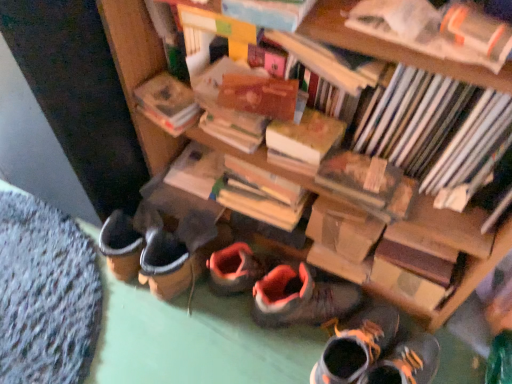
Locate an element on the screen. leather boot at lower center, arranged as the 1th footwear when viewed from the right is located at coordinates (356, 346).

What do you see at coordinates (356, 346) in the screenshot? I see `leather boot at lower center, the 2th footwear positioned from the left` at bounding box center [356, 346].

Find the location of a particular element. wooden bookcase at center is located at coordinates (138, 71).

Measure the distance between hardcover book at upper right, which appears as the fifth book when viewed from the back, and camera.

The distance of hardcover book at upper right, which appears as the fifth book when viewed from the back, from camera is 21.93 inches.

The width and height of the screenshot is (512, 384). Describe the element at coordinates (479, 27) in the screenshot. I see `hardcover book at upper right, which appears as the fifth book when viewed from the back` at that location.

Locate an element on the screen. This screenshot has width=512, height=384. hardcover books at upper right, which is the 3th book in front-to-back order is located at coordinates (433, 126).

Describe the element at coordinates (229, 188) in the screenshot. I see `hardcover book at center, which is the second book from back to front` at that location.

In order to click on hardcover book at upper center, positioned as the second book in front-to-back order in this screenshot , I will do `click(269, 12)`.

From the image's perspective, which is below, hardcover book at center, which is counted as the 1th book, starting from the back, or hardcover book at upper right, the 1th book viewed from the front?

hardcover book at center, which is counted as the 1th book, starting from the back.

Is hardcover book at center, arranged as the fifth book when viewed from the front, not close to hardcover book at upper right, the 1th book viewed from the front?

hardcover book at center, arranged as the fifth book when viewed from the front, is actually quite close to hardcover book at upper right, the 1th book viewed from the front.

From a real-world perspective, is hardcover book at center, arranged as the fifth book when viewed from the front, physically below hardcover book at upper right, which appears as the fifth book when viewed from the back?

Yes, from a real-world perspective, hardcover book at center, arranged as the fifth book when viewed from the front, is below hardcover book at upper right, which appears as the fifth book when viewed from the back.

You are a GUI agent. You are given a task and a screenshot of the screen. Output one action in this format:
    pyautogui.click(x=<x>, y=<y>)
    Task: Click on the 2nd book positioned above the hardcover book at center, which is counted as the 1th book, starting from the back (from the image's perspective)
    
    Given the screenshot: What is the action you would take?
    pyautogui.click(x=479, y=27)

Is there a large distance between hardcover books at upper right, which is the 3th book in front-to-back order, and hardcover book at upper right, which appears as the fifth book when viewed from the back?

No, there isn't a large distance between hardcover books at upper right, which is the 3th book in front-to-back order, and hardcover book at upper right, which appears as the fifth book when viewed from the back.

What's the angular difference between hardcover books at upper right, which is the 3th book in front-to-back order, and hardcover book at upper right, the 1th book viewed from the front,'s facing directions?

The angle between the facing direction of hardcover books at upper right, which is the 3th book in front-to-back order, and the facing direction of hardcover book at upper right, the 1th book viewed from the front, is 0.000267 degrees.

Consider the image. From the image's perspective, is hardcover books at upper right, marked as the third book in a back-to-front arrangement, located above or below hardcover book at upper right, which appears as the fifth book when viewed from the back?

From the image's perspective, hardcover books at upper right, marked as the third book in a back-to-front arrangement, appears below hardcover book at upper right, which appears as the fifth book when viewed from the back.

Is point (125, 61) closer to camera compared to point (282, 14)?

No, (125, 61) is behind (282, 14).

Is wooden bookcase at center taller or shorter than hardcover book at upper center, positioned as the second book in front-to-back order?

Clearly, wooden bookcase at center is shorter compared to hardcover book at upper center, positioned as the second book in front-to-back order.

Measure the distance from wooden bookcase at center to hardcover book at upper center, positioned as the second book in front-to-back order.

13.79 inches.

Can you tell me how much wooden bookcase at center and hardcover book at upper center, which is counted as the fourth book, starting from the back, differ in facing direction?

The facing directions of wooden bookcase at center and hardcover book at upper center, which is counted as the fourth book, starting from the back, are 88.3 degrees apart.

How different are the orientations of hardcover book at upper left, acting as the second paperback book starting from the right, and hardcover book at center, placed as the second paperback book when sorted from left to right, in degrees?

6.62 degrees.

Is hardcover book at upper left, acting as the second paperback book starting from the right, to the left or to the right of hardcover book at center, the 1th paperback book when ordered from right to left, in the image?

Based on their positions, hardcover book at upper left, acting as the second paperback book starting from the right, is located to the left of hardcover book at center, the 1th paperback book when ordered from right to left.

I want to click on paperback book below the hardcover book at upper left, acting as the second paperback book starting from the right (from the image's perspective), so click(x=305, y=136).

Which is closer to the camera, (157,106) or (324,128)?

The point (324,128) is in front.

Is wooden bookcase at center positioned far away from hardcover book at center, which is counted as the 4th book, starting from the front?

No, wooden bookcase at center is not far from hardcover book at center, which is counted as the 4th book, starting from the front.

Considering the sizes of wooden bookcase at center and hardcover book at center, which is the second book from back to front, in the image, is wooden bookcase at center wider or thinner than hardcover book at center, which is the second book from back to front,?

wooden bookcase at center is wider than hardcover book at center, which is the second book from back to front.

Is wooden bookcase at center further to the viewer compared to hardcover book at center, which is counted as the 4th book, starting from the front?

No.

Is wooden bookcase at center smaller than hardcover book at center, which is the second book from back to front?

Incorrect, wooden bookcase at center is not smaller in size than hardcover book at center, which is the second book from back to front.

Starting from the leather boot at lower center, the 2th footwear positioned from the left, which book is the 2nd one to the left? Please provide its 2D coordinates.

[(229, 188)]

Can we say leather boot at lower center, arranged as the 1th footwear when viewed from the right, lies outside hardcover book at center, which is the second book from back to front?

Absolutely, leather boot at lower center, arranged as the 1th footwear when viewed from the right, is external to hardcover book at center, which is the second book from back to front.

From the image's perspective, which one is positioned higher, leather boot at lower center, the 2th footwear positioned from the left, or hardcover book at center, which is counted as the 4th book, starting from the front?

hardcover book at center, which is counted as the 4th book, starting from the front.

Does leather boot at lower center, arranged as the 1th footwear when viewed from the right, have a greater width compared to hardcover book at center, which is counted as the 4th book, starting from the front?

Indeed, leather boot at lower center, arranged as the 1th footwear when viewed from the right, has a greater width compared to hardcover book at center, which is counted as the 4th book, starting from the front.

Is hardcover book at upper center, which is counted as the fourth book, starting from the back, oriented away from hardcover book at upper right, which appears as the fifth book when viewed from the back?

That's not correct — hardcover book at upper center, which is counted as the fourth book, starting from the back, is not looking away from hardcover book at upper right, which appears as the fifth book when viewed from the back.

From their relative heights in the image, would you say hardcover book at upper center, which is counted as the fourth book, starting from the back, is taller or shorter than hardcover book at upper right, which appears as the fifth book when viewed from the back?

hardcover book at upper center, which is counted as the fourth book, starting from the back, is taller than hardcover book at upper right, which appears as the fifth book when viewed from the back.

Is hardcover book at upper right, the 1th book viewed from the front, surrounded by hardcover book at upper center, which is counted as the fourth book, starting from the back?

No, hardcover book at upper center, which is counted as the fourth book, starting from the back, does not contain hardcover book at upper right, the 1th book viewed from the front.

Between hardcover book at upper center, positioned as the second book in front-to-back order, and hardcover book at upper right, which appears as the fifth book when viewed from the back, which one has smaller width?

Thinner between the two is hardcover book at upper right, which appears as the fifth book when viewed from the back.

The height and width of the screenshot is (384, 512). I want to click on the 4th book positioned above the hardcover book at center, arranged as the fifth book when viewed from the front (from a real-world perspective), so click(479, 27).

There is a hardcover books at upper right, marked as the third book in a back-to-front arrangement. Where is `the 1st book above it (from the image's perspective)`? The height and width of the screenshot is (384, 512). the 1st book above it (from the image's perspective) is located at coordinates (479, 27).

Considering their positions, is orange suede sneaker at center, acting as the second footwear starting from the right, positioned closer to hardcover book at center, placed as the second paperback book when sorted from left to right, than hardcover books at upper right, which is the 3th book in front-to-back order?

Based on the image, hardcover books at upper right, which is the 3th book in front-to-back order, appears to be nearer to hardcover book at center, placed as the second paperback book when sorted from left to right.

Based on the photo, looking at the image, which one is located further to hardcover books at upper right, which is the 3th book in front-to-back order, hardcover book at center, arranged as the fifth book when viewed from the front, or hardcover book at upper center, positioned as the second book in front-to-back order?

The object further to hardcover books at upper right, which is the 3th book in front-to-back order, is hardcover book at center, arranged as the fifth book when viewed from the front.

When comparing their distances from hardcover book at center, arranged as the fifth book when viewed from the front, does hardcover books at upper right, which is the 3th book in front-to-back order, or hardcover book at upper center, which is counted as the fourth book, starting from the back, seem further?

The object further to hardcover book at center, arranged as the fifth book when viewed from the front, is hardcover books at upper right, which is the 3th book in front-to-back order.

From the image, which object appears to be nearer to wooden bookcase at center, hardcover book at upper left, which is the first paperback book in left-to-right order, or hardcover book at center, which is counted as the 4th book, starting from the front?

hardcover book at upper left, which is the first paperback book in left-to-right order, lies closer to wooden bookcase at center than the other object.

When comparing their distances from wooden bookcase at center, does hardcover book at center, the 1th paperback book when ordered from right to left, or hardcover book at upper right, which appears as the fifth book when viewed from the back, seem further?

hardcover book at upper right, which appears as the fifth book when viewed from the back, is positioned further to the anchor wooden bookcase at center.

In the scene shown: Which object lies further to the anchor point hardcover book at upper left, which is the first paperback book in left-to-right order, hardcover book at upper center, which is counted as the fourth book, starting from the back, or orange suede sneaker at center, positioned as the first footwear in left-to-right order?

orange suede sneaker at center, positioned as the first footwear in left-to-right order, lies further to hardcover book at upper left, which is the first paperback book in left-to-right order, than the other object.

Looking at the image, which one is located closer to hardcover book at center, the 1th paperback book when ordered from right to left, hardcover book at center, which is counted as the 1th book, starting from the back, or orange suede sneaker at center, positioned as the first footwear in left-to-right order?

The object closer to hardcover book at center, the 1th paperback book when ordered from right to left, is orange suede sneaker at center, positioned as the first footwear in left-to-right order.

Considering their positions, is hardcover book at center, placed as the second paperback book when sorted from left to right, positioned further to hardcover book at upper left, acting as the second paperback book starting from the right, than hardcover books at upper right, marked as the third book in a back-to-front arrangement?

Among the two, hardcover books at upper right, marked as the third book in a back-to-front arrangement, is located further to hardcover book at upper left, acting as the second paperback book starting from the right.

The height and width of the screenshot is (384, 512). Identify the location of bookcase that lies between hardcover book at upper right, which appears as the fifth book when viewed from the back, and orange suede sneaker at center, positioned as the first footwear in left-to-right order, from top to bottom. (138, 71).

Where is `bookcase that lies between hardcover book at center, the 1th paperback book when ordered from right to left, and orange suede sneaker at center, acting as the second footwear starting from the right, from top to bottom`? This screenshot has height=384, width=512. bookcase that lies between hardcover book at center, the 1th paperback book when ordered from right to left, and orange suede sneaker at center, acting as the second footwear starting from the right, from top to bottom is located at coordinates (138, 71).

I want to click on bookcase between hardcover book at upper right, the 1th book viewed from the front, and hardcover book at center, which is counted as the 1th book, starting from the back, in the front-back direction, so click(x=138, y=71).

Find the location of a particular element. paperback book between hardcover book at center, placed as the second paperback book when sorted from left to right, and hardcover book at center, which is counted as the 1th book, starting from the back, in the front-back direction is located at coordinates (167, 103).